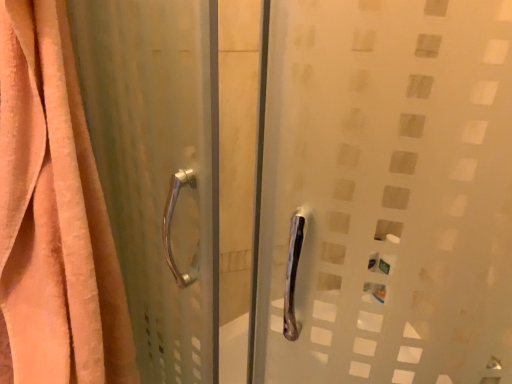
Locate an element on the screen. This screenshot has height=384, width=512. satin silver handle at left is located at coordinates coord(158,169).

Image resolution: width=512 pixels, height=384 pixels. What do you see at coordinates (158, 169) in the screenshot? I see `satin silver handle at left` at bounding box center [158, 169].

Find the location of a particular element. orange velvety curtain at left is located at coordinates (54, 214).

The image size is (512, 384). What do you see at coordinates (54, 214) in the screenshot?
I see `orange velvety curtain at left` at bounding box center [54, 214].

What is the approximate height of orange velvety curtain at left?

76.52 centimeters.

Locate an element on the screen. This screenshot has width=512, height=384. satin silver handle at left is located at coordinates (158, 169).

Considering the positions of objects orange velvety curtain at left and satin silver handle at left in the image provided, who is more to the right, orange velvety curtain at left or satin silver handle at left?

From the viewer's perspective, satin silver handle at left appears more on the right side.

Considering their positions, is orange velvety curtain at left located in front of or behind satin silver handle at left?

orange velvety curtain at left is behind satin silver handle at left.

Is point (49, 59) closer or farther from the camera than point (209, 156)?

Point (49, 59) appears to be farther away from the viewer than point (209, 156).

From the image's perspective, is orange velvety curtain at left located above or below satin silver handle at left?

Clearly, from the image's perspective, orange velvety curtain at left is above satin silver handle at left.

From a real-world perspective, is orange velvety curtain at left positioned under satin silver handle at left based on gravity?

No, from a real-world perspective, orange velvety curtain at left is not below satin silver handle at left.

Can you confirm if orange velvety curtain at left is wider than satin silver handle at left?

Indeed, orange velvety curtain at left has a greater width compared to satin silver handle at left.

Considering the relative sizes of orange velvety curtain at left and satin silver handle at left in the image provided, is orange velvety curtain at left taller than satin silver handle at left?

Incorrect, the height of orange velvety curtain at left is not larger of that of satin silver handle at left.

Between orange velvety curtain at left and satin silver handle at left, which one has larger size?

satin silver handle at left.

Is orange velvety curtain at left outside of satin silver handle at left?

Absolutely, orange velvety curtain at left is external to satin silver handle at left.

Is orange velvety curtain at left far from satin silver handle at left?

They are positioned close to each other.

Does orange velvety curtain at left turn towards satin silver handle at left?

No.

How many degrees apart are the facing directions of orange velvety curtain at left and satin silver handle at left?

They differ by 90 degrees in their facing directions.

Where is `curtain above the satin silver handle at left (from a real-world perspective)`? curtain above the satin silver handle at left (from a real-world perspective) is located at coordinates (54, 214).

Considering the relative positions of satin silver handle at left and orange velvety curtain at left in the image provided, is satin silver handle at left to the right of orange velvety curtain at left from the viewer's perspective?

Yes, satin silver handle at left is to the right of orange velvety curtain at left.

Considering their positions, is satin silver handle at left located in front of or behind orange velvety curtain at left?

Visually, satin silver handle at left is located in front of orange velvety curtain at left.

Which is farther from the camera, (203,306) or (31,62)?

The point (203,306) is behind.

From the image's perspective, which is above, satin silver handle at left or orange velvety curtain at left?

From the image's view, orange velvety curtain at left is above.

From a real-world perspective, is satin silver handle at left located beneath orange velvety curtain at left?

Yes, from a real-world perspective, satin silver handle at left is beneath orange velvety curtain at left.

Considering the sizes of satin silver handle at left and orange velvety curtain at left in the image, is satin silver handle at left wider or thinner than orange velvety curtain at left?

Clearly, satin silver handle at left has less width compared to orange velvety curtain at left.

Is satin silver handle at left shorter than orange velvety curtain at left?

Incorrect, the height of satin silver handle at left does not fall short of that of orange velvety curtain at left.

Between satin silver handle at left and orange velvety curtain at left, which one has larger size?

satin silver handle at left.

Is orange velvety curtain at left completely or partially inside satin silver handle at left?

Actually, orange velvety curtain at left is outside satin silver handle at left.

Are satin silver handle at left and orange velvety curtain at left located far from each other?

No, satin silver handle at left is not far from orange velvety curtain at left.

Is satin silver handle at left turned away from orange velvety curtain at left?

Yes, orange velvety curtain at left is at the back of satin silver handle at left.

How much distance is there between satin silver handle at left and orange velvety curtain at left?

The distance of satin silver handle at left from orange velvety curtain at left is 4.71 inches.

I want to click on curtain that is above the satin silver handle at left (from the image's perspective), so click(x=54, y=214).

Locate an element on the screen. curtain behind the satin silver handle at left is located at coordinates (54, 214).

Find the location of a particular element. This screenshot has height=384, width=512. curtain above the satin silver handle at left (from a real-world perspective) is located at coordinates (54, 214).